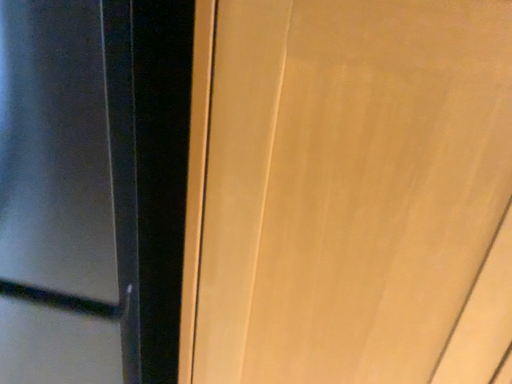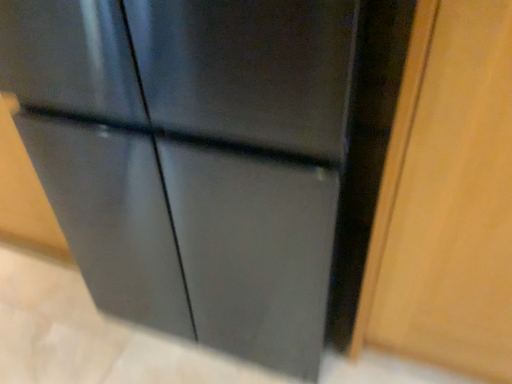
Question: Which way did the camera rotate in the video?

Choices:
 (A) rotated right
 (B) rotated left

Answer: (B)